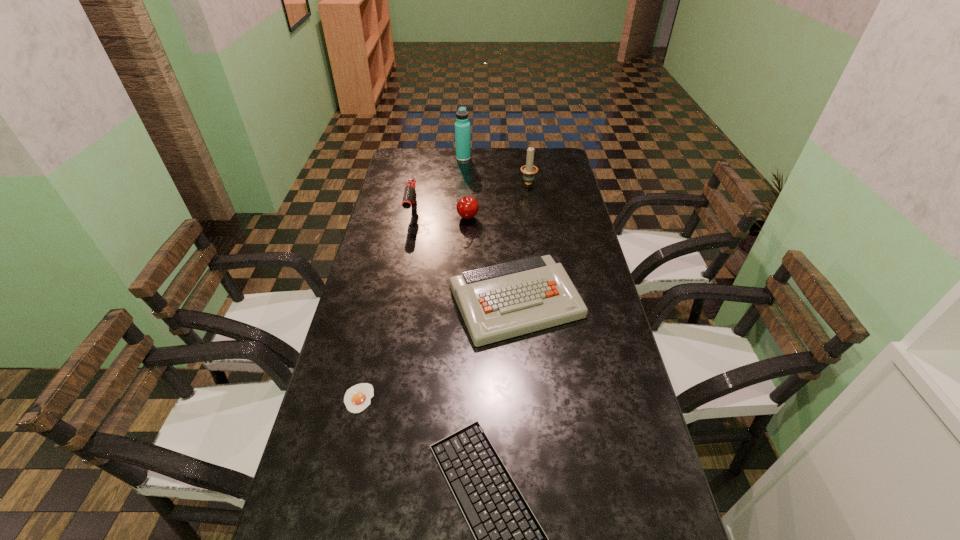
This screenshot has height=540, width=960. I want to click on egg yolk located at the left edge, so click(x=357, y=398).

At what (x,y) coordinates should I click in order to perform the action: click on candle_holder located at the right edge. Please return your answer as a coordinate pair (x, y). This screenshot has width=960, height=540. Looking at the image, I should click on (529, 170).

Find the location of a particular element. Image resolution: width=960 pixels, height=540 pixels. computer keyboard that is at the right edge is located at coordinates (499, 302).

I want to click on vacant space at the far edge of the desktop, so click(446, 150).

Find the location of a particular element. vacant space at the left edge of the desktop is located at coordinates (423, 194).

Find the location of a particular element. vacant space at the right edge of the desktop is located at coordinates (563, 244).

In the image, there is a desktop. Identify the location of free region at the far left corner. (394, 170).

I want to click on vacant space at the far right corner of the desktop, so click(554, 158).

You are a GUI agent. You are given a task and a screenshot of the screen. Output one action in this format:
    pyautogui.click(x=<x>, y=<y>)
    Task: Click on the vacant point located between the candle_holder and the farthest object
    This screenshot has width=960, height=540.
    Given the screenshot: What is the action you would take?
    pyautogui.click(x=495, y=170)

Find the location of a particular element. vacant area between the tallest object and the shortest object is located at coordinates (411, 278).